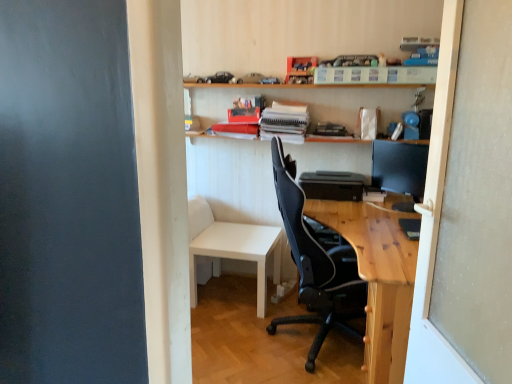
Question: Does white matte table at lower center have a greater height compared to wooden shelf at upper center?

Choices:
 (A) no
 (B) yes

Answer: (A)

Question: Is white matte table at lower center facing towards wooden shelf at upper center?

Choices:
 (A) yes
 (B) no

Answer: (B)

Question: Is the position of white matte table at lower center more distant than that of wooden shelf at upper center?

Choices:
 (A) no
 (B) yes

Answer: (B)

Question: From a real-world perspective, is white matte table at lower center under wooden shelf at upper center?

Choices:
 (A) yes
 (B) no

Answer: (A)

Question: Considering the relative sizes of white matte table at lower center and wooden shelf at upper center in the image provided, is white matte table at lower center bigger than wooden shelf at upper center?

Choices:
 (A) no
 (B) yes

Answer: (A)

Question: Looking at the image, does black mesh chair at center seem bigger or smaller compared to white matte table at lower center?

Choices:
 (A) small
 (B) big

Answer: (B)

Question: From the image's perspective, is black mesh chair at center positioned above or below white matte table at lower center?

Choices:
 (A) above
 (B) below

Answer: (A)

Question: Is point (352, 309) positioned closer to the camera than point (273, 256)?

Choices:
 (A) closer
 (B) farther

Answer: (A)

Question: In terms of width, does black mesh chair at center look wider or thinner when compared to white matte table at lower center?

Choices:
 (A) thin
 (B) wide

Answer: (B)

Question: From their relative heights in the image, would you say black glossy monitor at upper right is taller or shorter than white matte table at lower center?

Choices:
 (A) tall
 (B) short

Answer: (B)

Question: Visually, is black glossy monitor at upper right positioned to the left or to the right of white matte table at lower center?

Choices:
 (A) right
 (B) left

Answer: (A)

Question: Would you say black glossy monitor at upper right is inside or outside white matte table at lower center?

Choices:
 (A) inside
 (B) outside

Answer: (B)

Question: Looking at the image, does black glossy monitor at upper right seem bigger or smaller compared to white matte table at lower center?

Choices:
 (A) small
 (B) big

Answer: (A)

Question: From a real-world perspective, is black plastic printer at center above or below black glossy monitor at upper right?

Choices:
 (A) below
 (B) above

Answer: (A)

Question: Considering the positions of black plastic printer at center and black glossy monitor at upper right in the image, is black plastic printer at center taller or shorter than black glossy monitor at upper right?

Choices:
 (A) tall
 (B) short

Answer: (B)